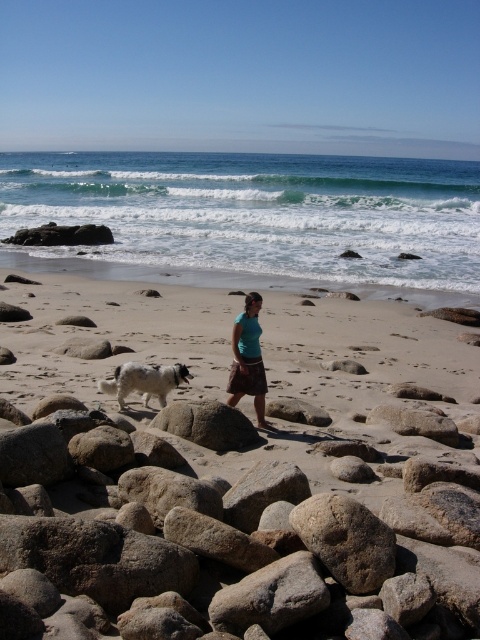
You are standing at the point marked as point (266, 275) on the beach. Looking around, you see the woman wearing a teal top and dark skirt and the white dog with black markings. Which direction should you walk to reach the woman and the dog?

Since the point (266, 275) is on the sandy beach at lower center, you should walk north to reach the woman and the dog who are near the center of the frame.

You are planning to set up a small picnic area on the sandy beach at lower center and the smooth gray rock at center. Which location would provide more space for your picnic setup?

The sandy beach at lower center has a larger size compared to the smooth gray rock at center, so it would provide more space for the picnic setup.

You are standing at the edge of the beach and want to walk towards the smooth sand beach at center and the sandy beach at lower center. Which one will you reach first?

You will reach the smooth sand beach at center first because it is closer to you than the sandy beach at lower center.